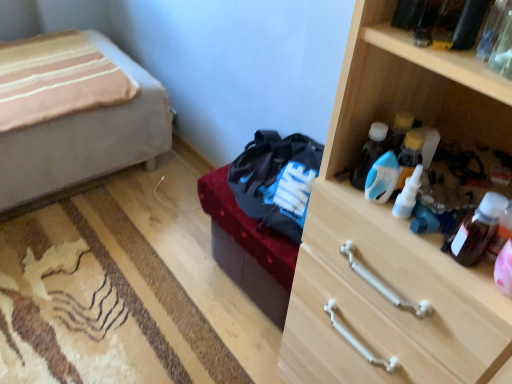
Question: Is blue plastic bottle at center right, the second bottle in the left-to-right sequence, looking in the opposite direction of translucent plastic bottle at upper right, which is the 3th bottle in left-to-right order?

Choices:
 (A) yes
 (B) no

Answer: (B)

Question: Does blue plastic bottle at center right, the second bottle in the left-to-right sequence, turn towards translucent plastic bottle at upper right, which is the 3th bottle in right-to-left order?

Choices:
 (A) no
 (B) yes

Answer: (A)

Question: Considering the relative sizes of blue plastic bottle at center right, placed as the 4th bottle when sorted from right to left, and translucent plastic bottle at upper right, which is the 3th bottle in left-to-right order, in the image provided, is blue plastic bottle at center right, placed as the 4th bottle when sorted from right to left, wider than translucent plastic bottle at upper right, which is the 3th bottle in left-to-right order,?

Choices:
 (A) no
 (B) yes

Answer: (A)

Question: Is blue plastic bottle at center right, the second bottle in the left-to-right sequence, touching translucent plastic bottle at upper right, which is the 3th bottle in left-to-right order?

Choices:
 (A) yes
 (B) no

Answer: (A)

Question: Does blue plastic bottle at center right, placed as the 4th bottle when sorted from right to left, have a greater height compared to translucent plastic bottle at upper right, which is the 3th bottle in left-to-right order?

Choices:
 (A) no
 (B) yes

Answer: (B)

Question: Considering the relative sizes of blue plastic bottle at center right, the second bottle in the left-to-right sequence, and translucent plastic bottle at upper right, which is the 3th bottle in left-to-right order, in the image provided, is blue plastic bottle at center right, the second bottle in the left-to-right sequence, smaller than translucent plastic bottle at upper right, which is the 3th bottle in left-to-right order,?

Choices:
 (A) no
 (B) yes

Answer: (A)

Question: Is beige fabric bed at left positioned with its back to translucent plastic bottle at upper right, which is the 3th bottle in left-to-right order?

Choices:
 (A) yes
 (B) no

Answer: (B)

Question: Is the position of beige fabric bed at left more distant than that of translucent plastic bottle at upper right, which is the 3th bottle in left-to-right order?

Choices:
 (A) yes
 (B) no

Answer: (A)

Question: Does beige fabric bed at left have a lesser width compared to translucent plastic bottle at upper right, which is the 3th bottle in left-to-right order?

Choices:
 (A) no
 (B) yes

Answer: (A)

Question: From the image's perspective, is beige fabric bed at left on translucent plastic bottle at upper right, which is the 3th bottle in right-to-left order?

Choices:
 (A) no
 (B) yes

Answer: (B)

Question: Is beige fabric bed at left not close to translucent plastic bottle at upper right, which is the 3th bottle in right-to-left order?

Choices:
 (A) no
 (B) yes

Answer: (B)

Question: Is translucent plastic bottle at upper right, which is the 3th bottle in right-to-left order, inside beige fabric bed at left?

Choices:
 (A) no
 (B) yes

Answer: (A)

Question: Is white plastic bottle at upper right, which ranks as the fourth bottle in left-to-right order, shorter than dark brown leather bed frame at center?

Choices:
 (A) yes
 (B) no

Answer: (A)